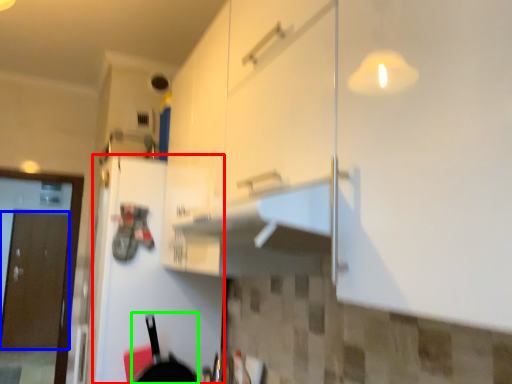
Question: Estimate the real-world distances between objects in this image. Which object is farther from door (highlighted by a red box), door (highlighted by a blue box) or frying pan (highlighted by a green box)?

Choices:
 (A) door
 (B) frying pan

Answer: (A)